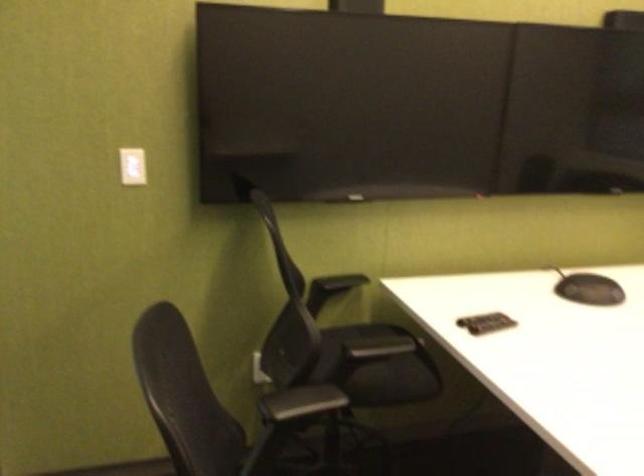
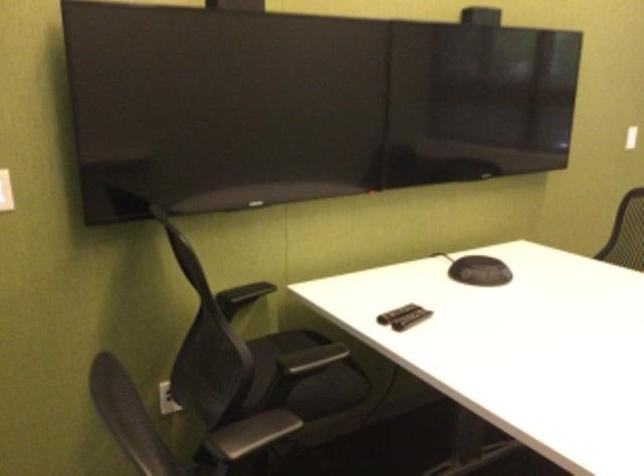
Find the pixel in the second image that matches [491,326] in the first image.

(411, 319)